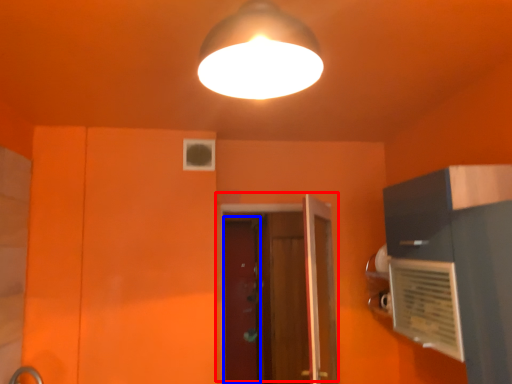
Question: Which point is further to the camera, door (highlighted by a red box) or screen door (highlighted by a blue box)?

Choices:
 (A) door
 (B) screen door

Answer: (B)